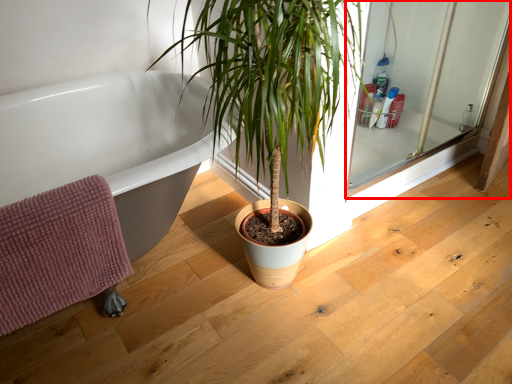
Question: From the image's perspective, considering the relative positions of screen door (annotated by the red box) and bath towel in the image provided, where is screen door (annotated by the red box) located with respect to the staircase?

Choices:
 (A) below
 (B) above

Answer: (B)